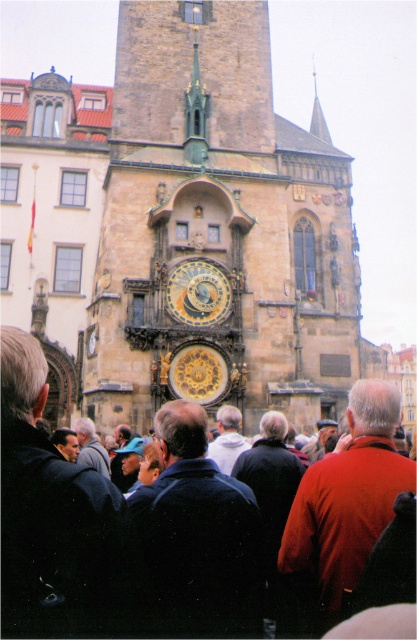
Between point (226, 556) and point (324, 125), which one is positioned behind?

The point (324, 125) is behind.

Is point (5, 413) positioned after point (316, 131)?

No, (5, 413) is in front of (316, 131).

Locate an element on the screen. The width and height of the screenshot is (417, 640). dark brown leather jacket at center is located at coordinates [58, 524].

Which is more to the left, red wool sweater at center or smooth silver spire at upper center?

From the viewer's perspective, red wool sweater at center appears more on the left side.

Between point (377, 508) and point (314, 77), which one is positioned in front?

Point (377, 508) is more forward.

This screenshot has width=417, height=640. I want to click on red wool sweater at center, so (341, 509).

Measure the distance between dark brown leather jacket at center and camera.

They are 26.78 meters apart.

How distant is dark brown leather jacket at center from gold/yellow metal/brass clock at center?

30.55 meters

Is point (83, 465) farther from camera compared to point (215, 300)?

No.

Locate an element on the screen. This screenshot has height=640, width=417. dark brown leather jacket at center is located at coordinates (58, 524).